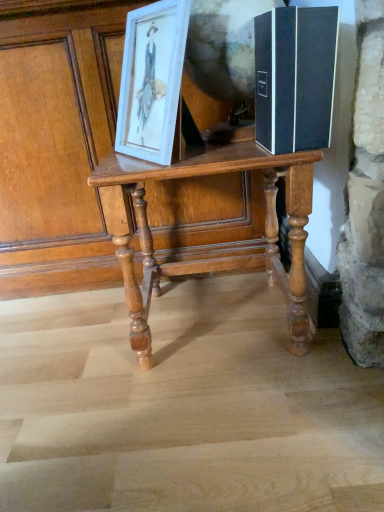
Where is `blank area to the left of wooden table at center`? The image size is (384, 512). blank area to the left of wooden table at center is located at coordinates (71, 346).